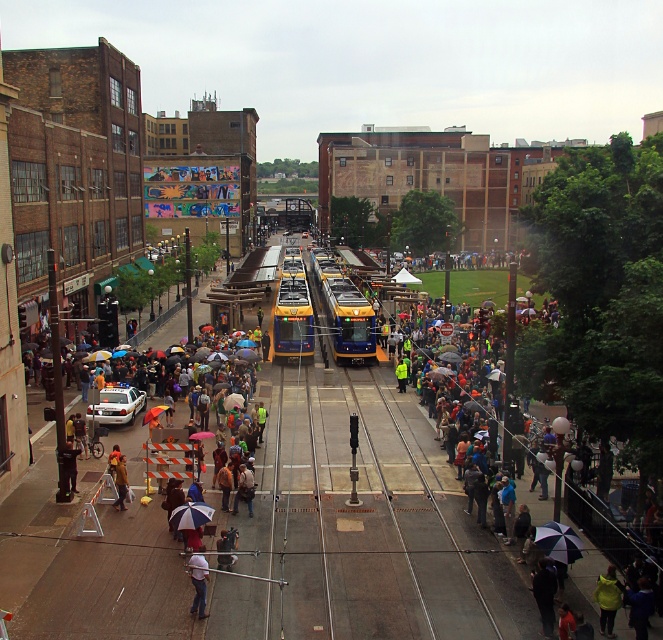
Question: Which point is closer to the camera?

Choices:
 (A) (198, 611)
 (B) (151, 408)
 (C) (186, 516)
 (D) (123, 488)

Answer: (A)

Question: Does brown leather jacket at lower left have a smaller size compared to orange fabric umbrella at center?

Choices:
 (A) yes
 (B) no

Answer: (A)

Question: Which object is the farthest from the dark blue fabric umbrella at lower right?

Choices:
 (A) brown leather jacket at lower left
 (B) blue fabric umbrella at lower center
 (C) white matte shirt at lower center

Answer: (A)

Question: Is dark blue fabric umbrella at lower right thinner than orange fabric umbrella at center?

Choices:
 (A) no
 (B) yes

Answer: (B)

Question: Can you confirm if white matte shirt at lower center is positioned to the right of orange fabric umbrella at center?

Choices:
 (A) no
 (B) yes

Answer: (B)

Question: Which object is closer to the camera taking this photo?

Choices:
 (A) dark blue fabric umbrella at lower right
 (B) orange fabric umbrella at center
 (C) blue fabric umbrella at lower center
 (D) white matte shirt at lower center

Answer: (D)